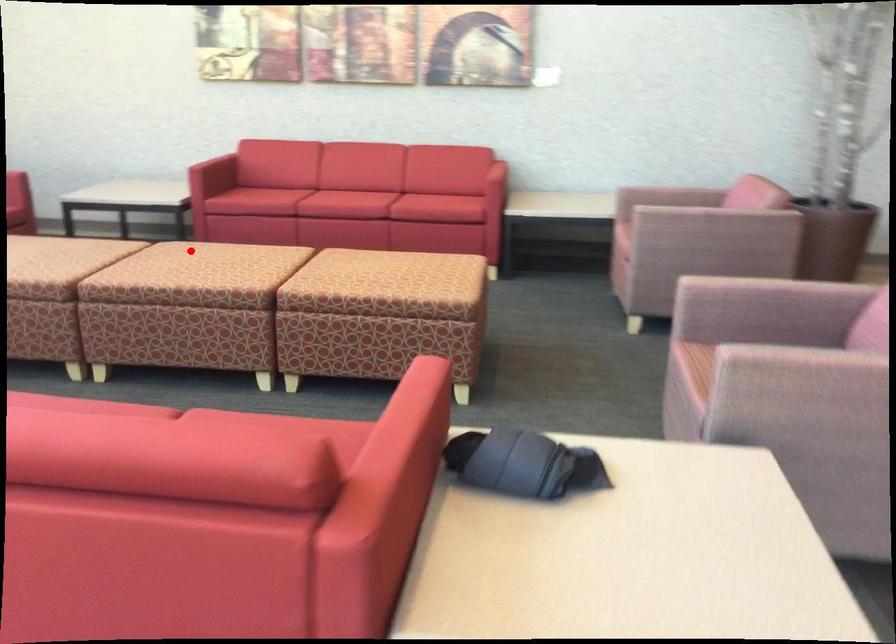
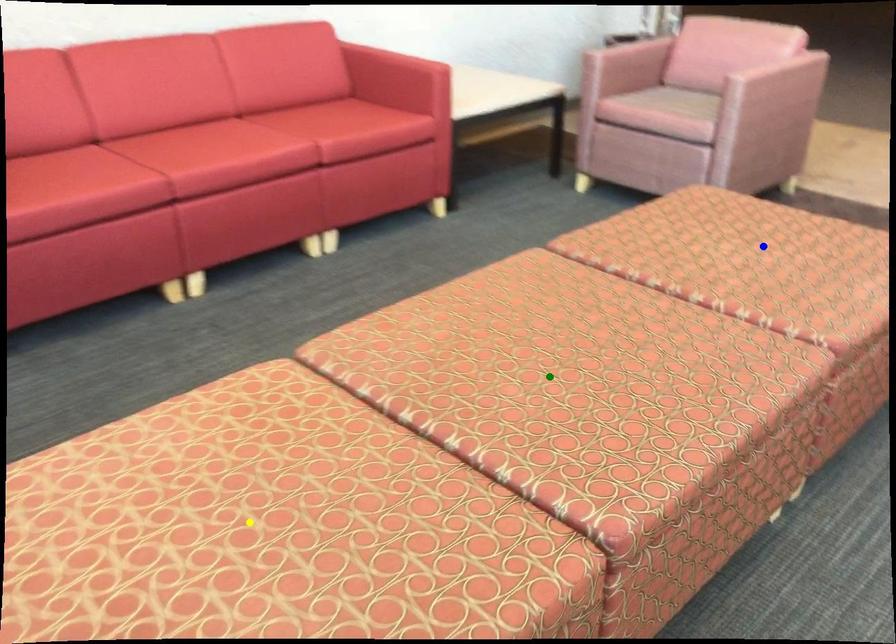
Question: I am providing you with two images of the same scene from different viewpoints. A red point is marked on the first image. You are given multiple points on the second image. Which point in image 2 is actually the same real-world point as the red point in image 1?

Choices:
 (A) blue point
 (B) yellow point
 (C) green point

Answer: (C)